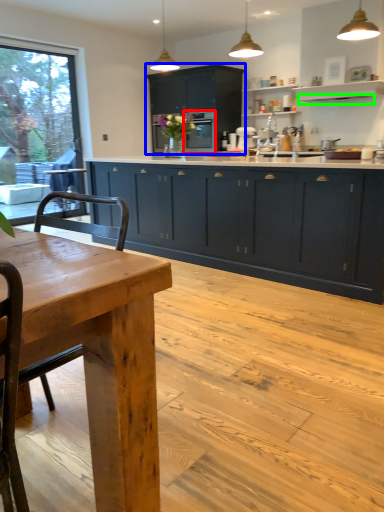
Question: Which object is positioned farthest from screen door (highlighted by a red box)? Select from cabinetry (highlighted by a blue box) and exhaust hood (highlighted by a green box).

Choices:
 (A) cabinetry
 (B) exhaust hood

Answer: (B)